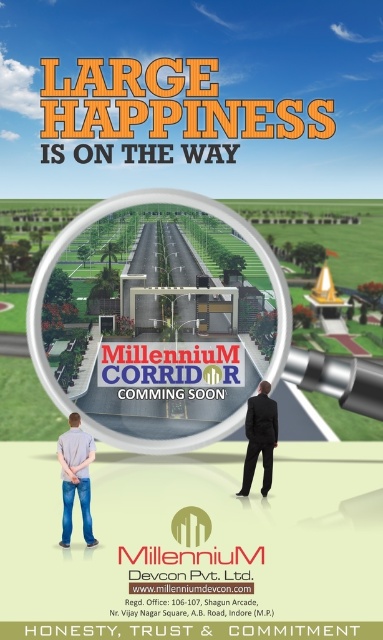
Question: Can you confirm if light gray shirt at lower left is positioned to the right of black suit at center?

Choices:
 (A) yes
 (B) no

Answer: (B)

Question: Does transparent glass magnifying glass at center have a greater width compared to light gray shirt at lower left?

Choices:
 (A) no
 (B) yes

Answer: (B)

Question: Which of the following is the farthest from the observer?

Choices:
 (A) transparent glass magnifying glass at center
 (B) light gray shirt at lower left

Answer: (A)

Question: Is light gray shirt at lower left bigger than black suit at center?

Choices:
 (A) yes
 (B) no

Answer: (B)

Question: Which point is closer to the camera?

Choices:
 (A) light gray shirt at lower left
 (B) transparent glass magnifying glass at center

Answer: (A)

Question: Which of these objects is positioned closest to the transparent glass magnifying glass at center?

Choices:
 (A) black suit at center
 (B) light gray shirt at lower left

Answer: (A)